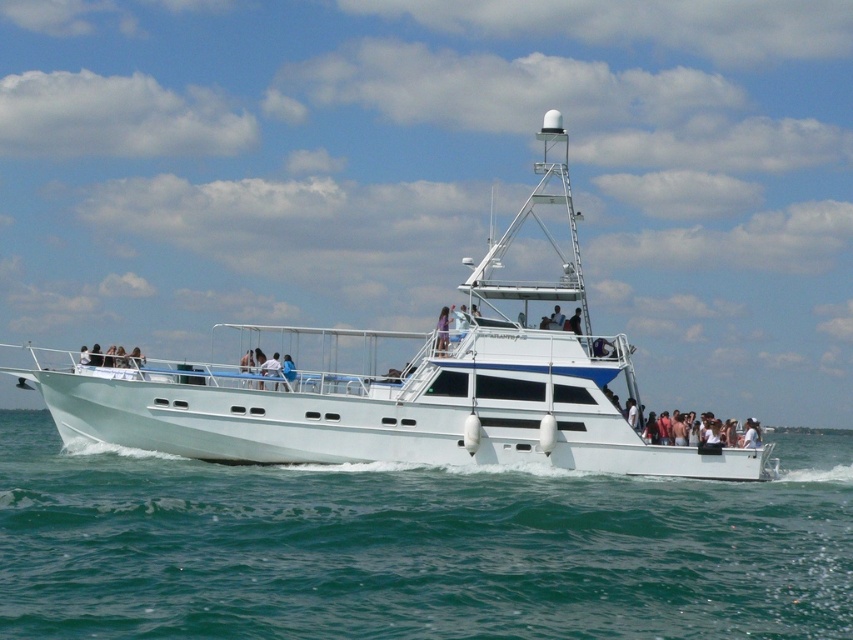
You are navigating a drone over the water and need to drop an anchor near the white glossy boat at center. According to the coordinates provided, where should you aim to drop the anchor relative to the boat?

The white glossy boat at center is located at point (404, 385), so you should aim to drop the anchor near those coordinates relative to the boat.